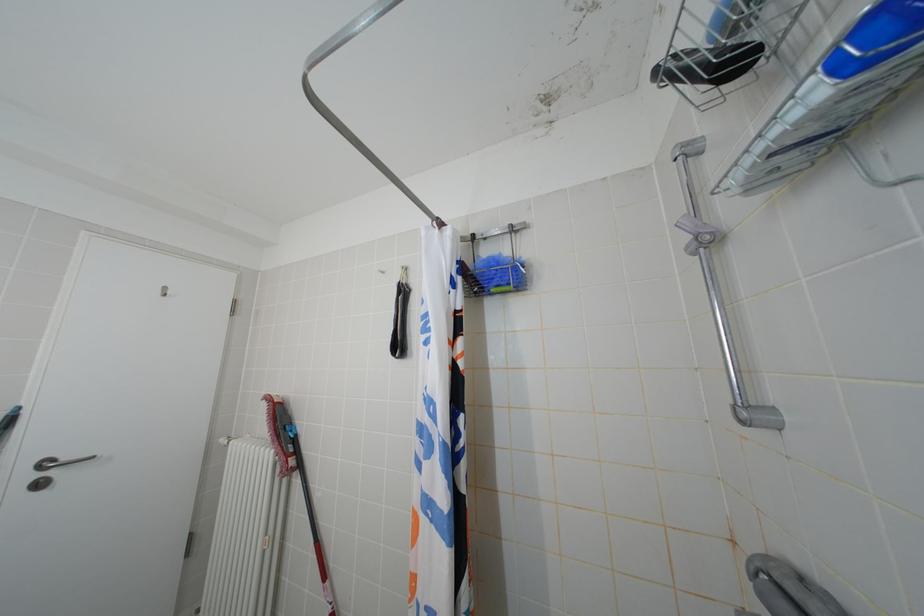
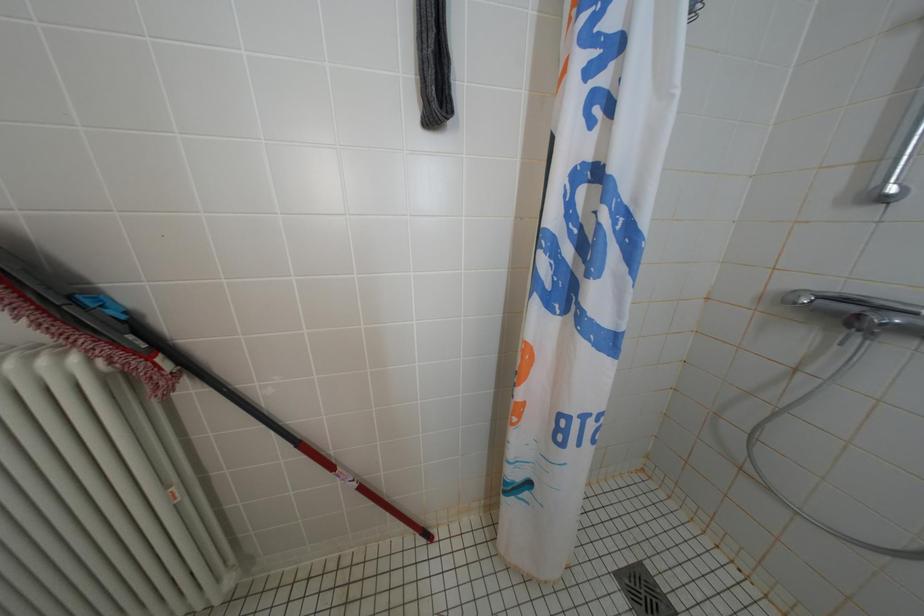
The images are taken continuously from a first-person perspective. In which direction is your viewpoint rotating?

The rotation direction of the camera is right-down.